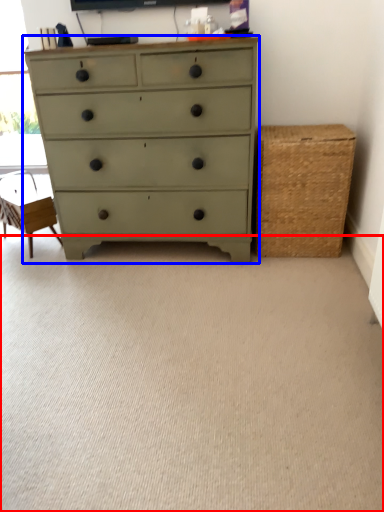
Question: Which point is closer to the camera, plain (highlighted by a red box) or chest of drawers (highlighted by a blue box)?

Choices:
 (A) plain
 (B) chest of drawers

Answer: (A)